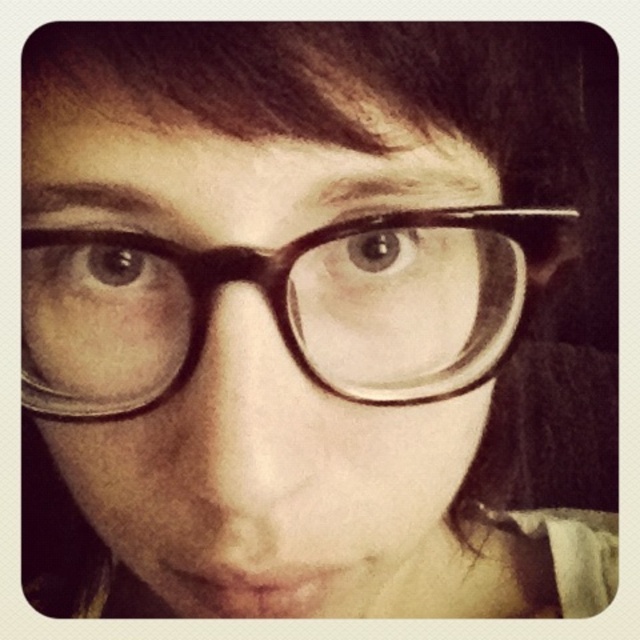
You are trying to decide between two pairs of glasses for a photo shoot. The scene requires the glasses to be as wide as possible to frame the face. Which pair would you choose between the matte black glasses at center and the black plastic glasses at center?

The matte black glasses at center are wider than the black plastic glasses at center, so you should choose the matte black glasses at center for the photo shoot to achieve the widest framing of the face.

You are a photographer adjusting the lighting for a portrait. You notice two pairs of glasses on the table in front of you, labeled as matte black glasses at center and black plastic glasses at center. Since you want to ensure the glasses are clearly visible in the photo, which pair should you choose based on their size?

The matte black glasses at center has a greater height compared to the black plastic glasses at center, so you should choose the matte black glasses at center as they are larger and will be more visible in the photo.

You are a photographer adjusting the focus on a camera. The subject is wearing matte black glasses at center. Based on the scene description, where should you focus to ensure the glasses are in sharp focus?

The matte black glasses at center are located at point (x=230, y=353), so you should focus at that coordinate to ensure sharpness.